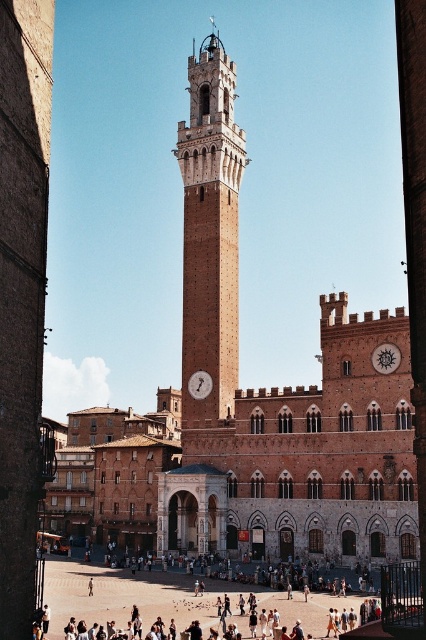
Question: From the image, what is the correct spatial relationship of metallic circular clock at center-right in relation to matte brown clock at center?

Choices:
 (A) right
 (B) left

Answer: (A)

Question: Does sandy brown brick clock tower at center appear on the right side of metallic circular clock at center-right?

Choices:
 (A) no
 (B) yes

Answer: (A)

Question: Considering the real-world distances, which object is farthest from the metallic circular clock at center-right?

Choices:
 (A) matte brown clock at center
 (B) sandy brown brick clock tower at center

Answer: (B)

Question: Considering the relative positions of metallic circular clock at center-right and matte brown clock at center in the image provided, where is metallic circular clock at center-right located with respect to matte brown clock at center?

Choices:
 (A) right
 (B) left

Answer: (A)

Question: Based on their relative distances, which object is nearer to the metallic circular clock at center-right?

Choices:
 (A) sandy brown brick clock tower at center
 (B) matte brown clock at center

Answer: (B)

Question: Which object is positioned farthest from the sandy brown brick clock tower at center?

Choices:
 (A) matte brown clock at center
 (B) metallic circular clock at center-right

Answer: (B)